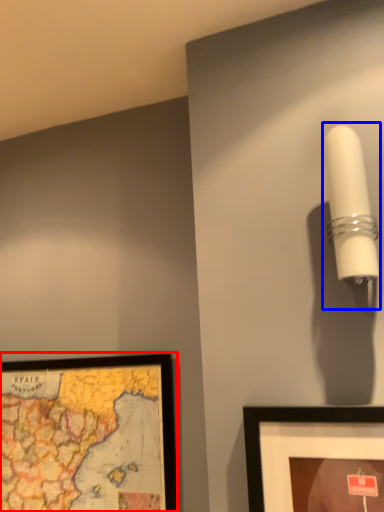
Question: Which of the following is the closest to the observer, picture frame (highlighted by a red box) or lamp (highlighted by a blue box)?

Choices:
 (A) picture frame
 (B) lamp

Answer: (B)